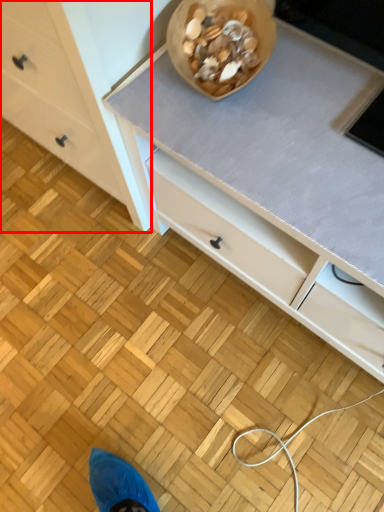
Question: From the image's perspective, what is the correct spatial relationship of chest of drawers (annotated by the red box) in relation to food?

Choices:
 (A) above
 (B) below

Answer: (A)